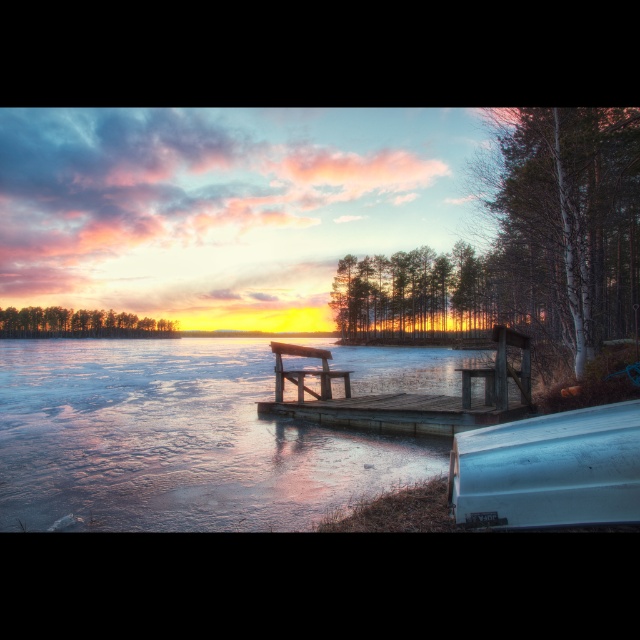
You are standing at the center of the frozen lake and see the white matte boat at lower right. If you walk straight towards the boat, will you reach it before the edge of the lake?

The white matte boat at lower right is located at point (548, 468), which is closer to the edge of the lake than your starting position at the center. Therefore, you will reach the edge of the lake before reaching the boat.

You are standing at the frozen lake and want to walk towards the two points marked in the image. Which point, point (356, 467) or point (280, 384), will you reach first?

Point (356, 467) is closer to the camera than point (280, 384), so you will reach point (356, 467) first.

You are a photographer planning to capture the sunset reflection on the transparent ice at center and the wooden bench at center. Which object will have a clearer reflection in the frozen lake?

The transparent ice at center is taller than the wooden bench at center, so the reflection of the transparent ice at center will be clearer.